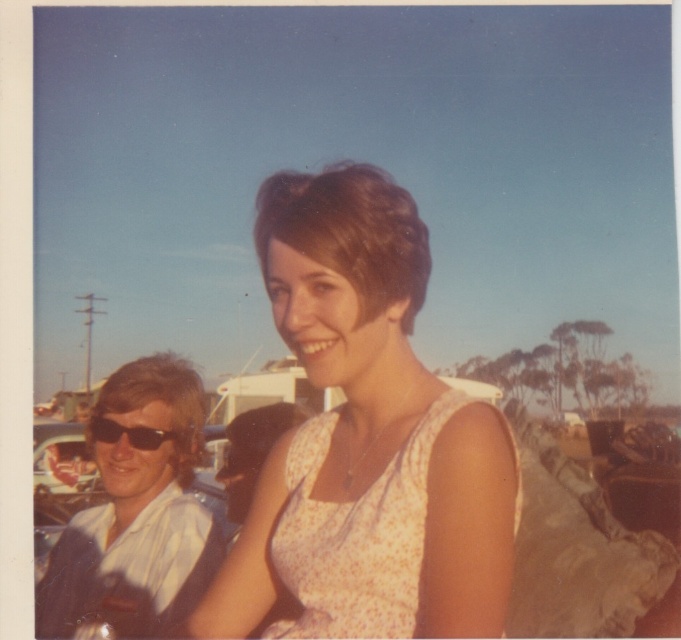
You are standing in the scene and want to hand a water bottle to the person wearing the white shirt at left. Based on their position relative to you, in which general direction should you walk to reach them?

The white shirt at left is located at point 0.797 on the x and 0.201 on the y axis. Since the person is at the lower left portion of the scene, you should walk towards the left and slightly forward to reach them.

You are standing in the scene and want to reach the point marked at coordinates point (159, 566). If you take a step forward, will you get closer to or farther from that point?

The point (159, 566) is 8.42 feet from the viewer. Taking a step forward would decrease the distance, so you would get closer to the point (159, 566).

Based on the scene description, can you determine if the floral fabric dress at center has a larger width than the white shirt at left?

The floral fabric dress at center is wider than the white shirt at left according to the description.